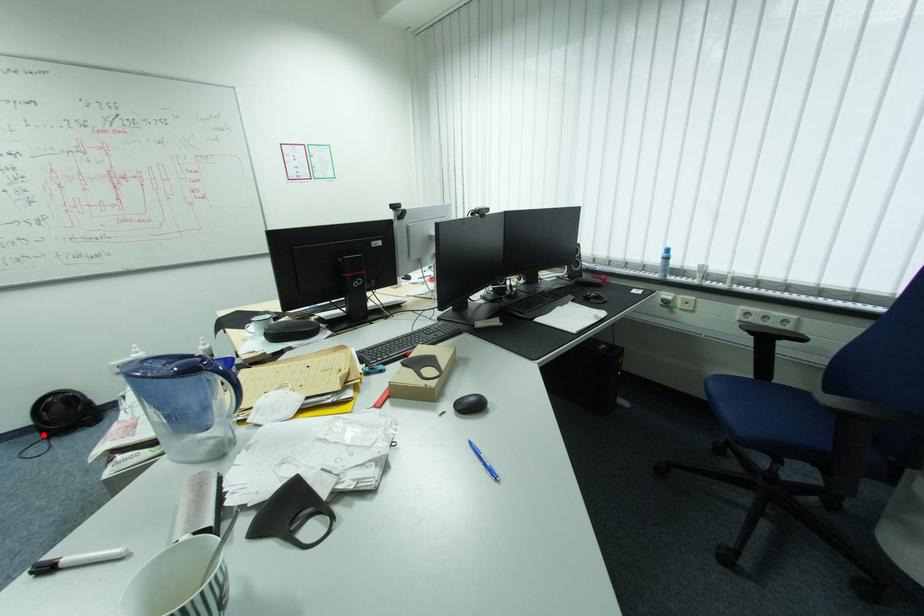
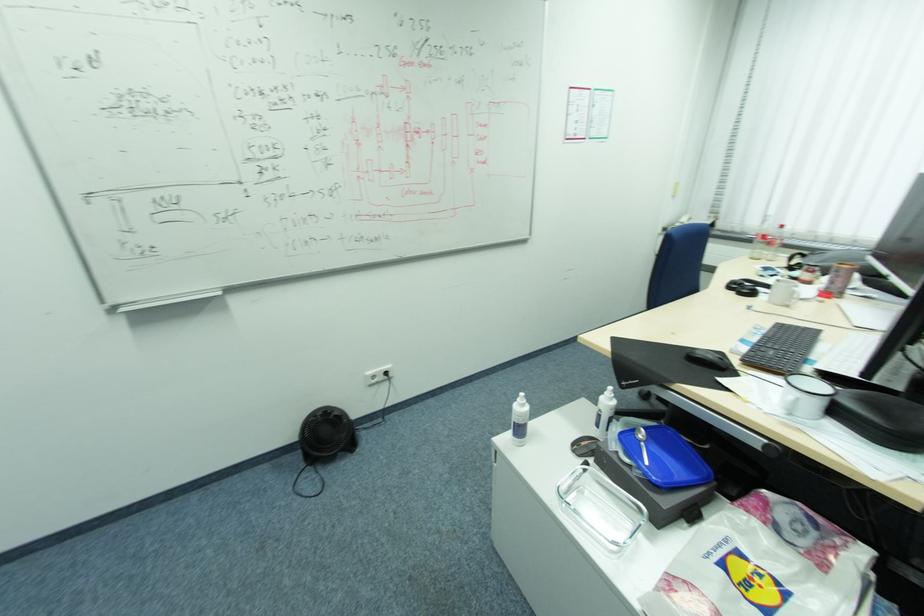
In the second image, find the point that corresponds to the highlighted location in the first image.

(304, 456)